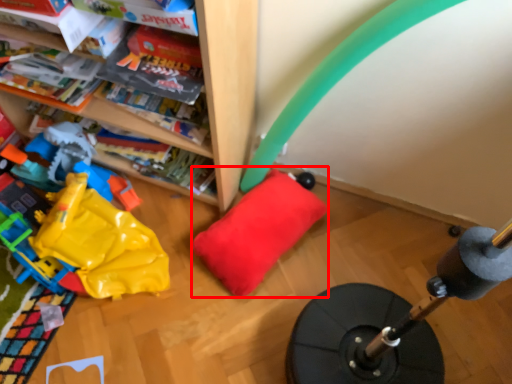
Question: From the image's perspective, where is pillow (annotated by the red box) located in relation to toy in the image?

Choices:
 (A) above
 (B) below

Answer: (B)